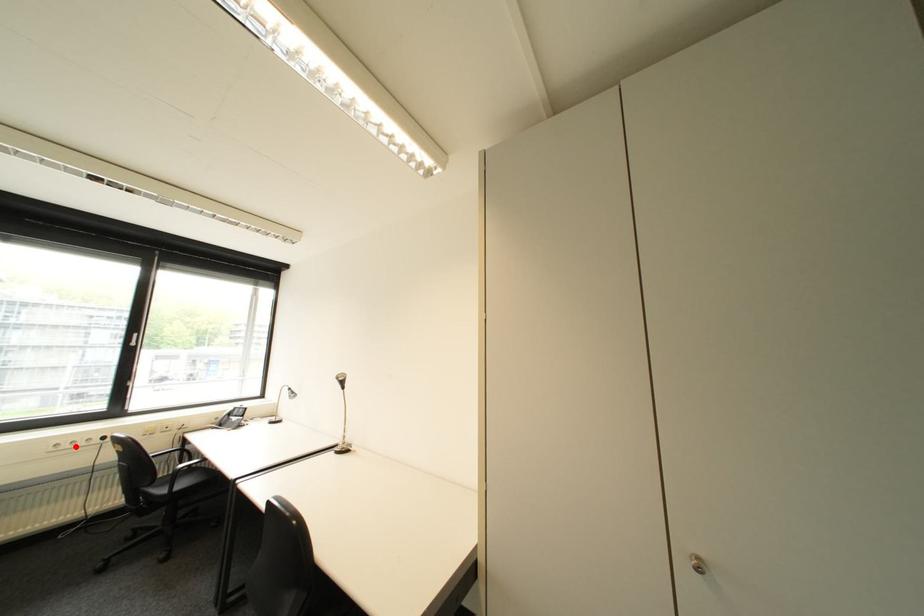
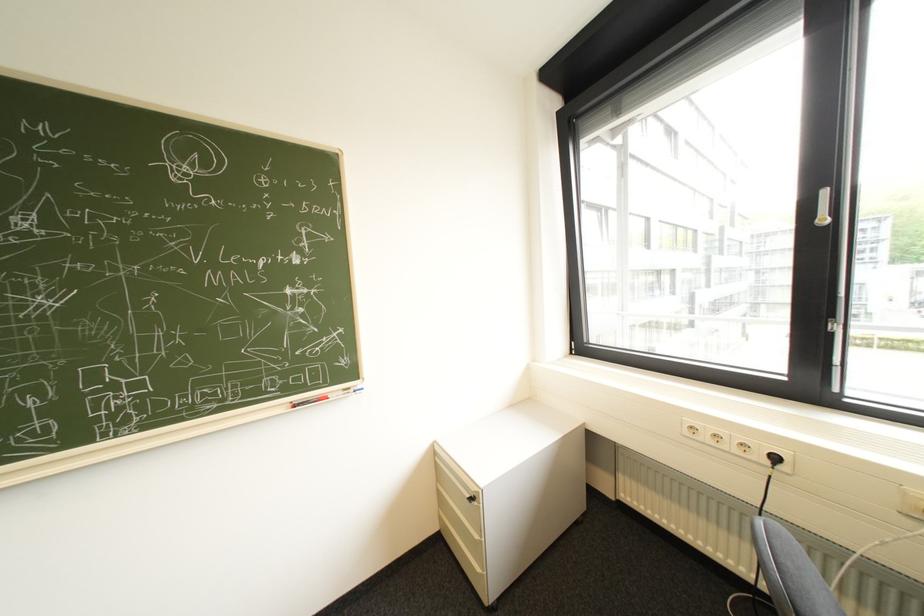
In the second image, find the point that corresponds to the highlighted location in the first image.

(715, 438)